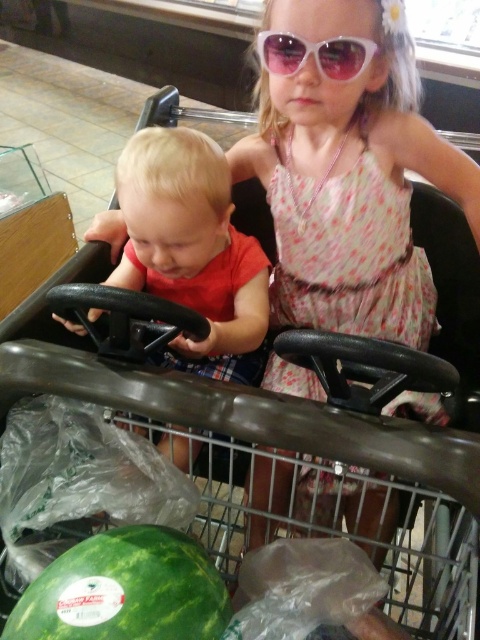
You are a parent trying to secure a toy for your child. The toy requires a container that is wider than the matte black steering wheel at left. Do you think the white plastic goggles at upper center can be used as the container?

The matte black steering wheel at left is wider than the white plastic goggles at upper center, so the white plastic goggles at upper center cannot be used as the container since it is narrower than the required width.

Looking at this image, you are a parent trying to place a small toy between the matte black steering wheel at left and the green matte watermelon at lower left. Which object should you place the toy closer to to ensure it fits between them?

The toy should be placed closer to the green matte watermelon at lower left because the matte black steering wheel at left is wider than the green matte watermelon at lower left, so the narrower space near the watermelon would accommodate the toy better.